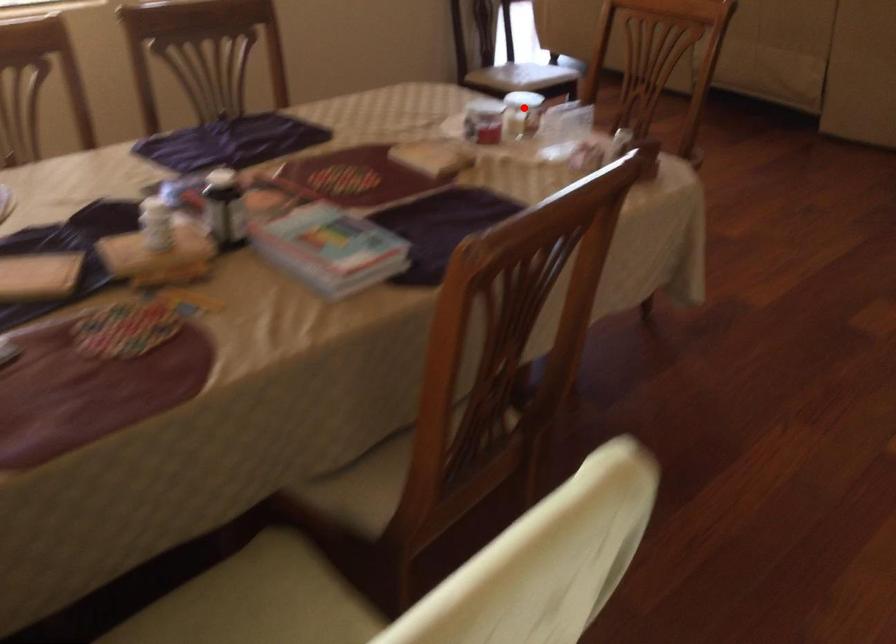
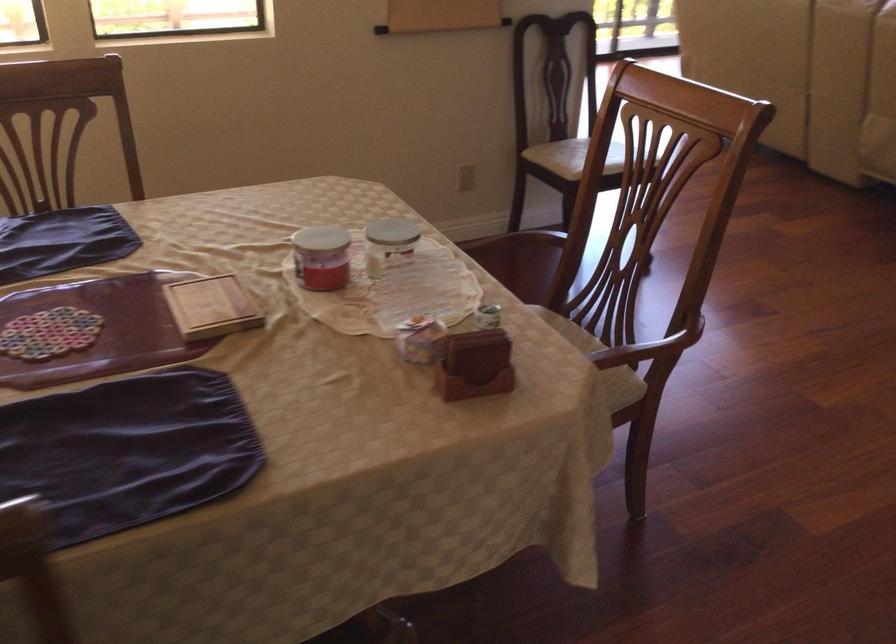
Question: I am providing you with two images of the same scene from different viewpoints. In image1, a red point is highlighted. Considering the same 3D point in image2, which of the following is correct?

Choices:
 (A) It is closer
 (B) It is farther

Answer: (A)